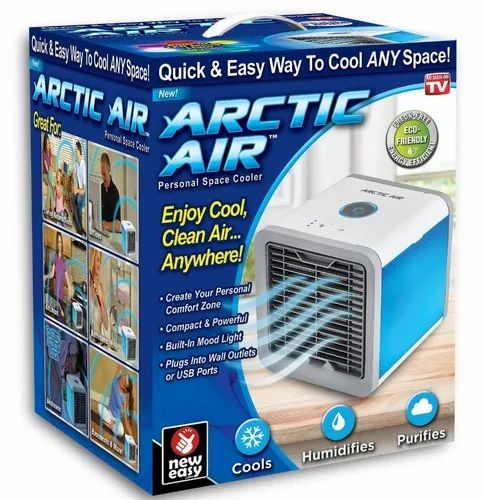
Where is `countertop`? This screenshot has width=482, height=500. countertop is located at coordinates (436, 369).